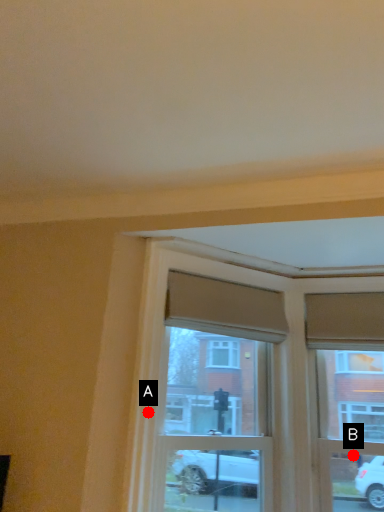
Question: Two points are circled on the image, labeled by A and B beside each circle. Which point is closer to the camera taking this photo?

Choices:
 (A) A is closer
 (B) B is closer

Answer: (A)